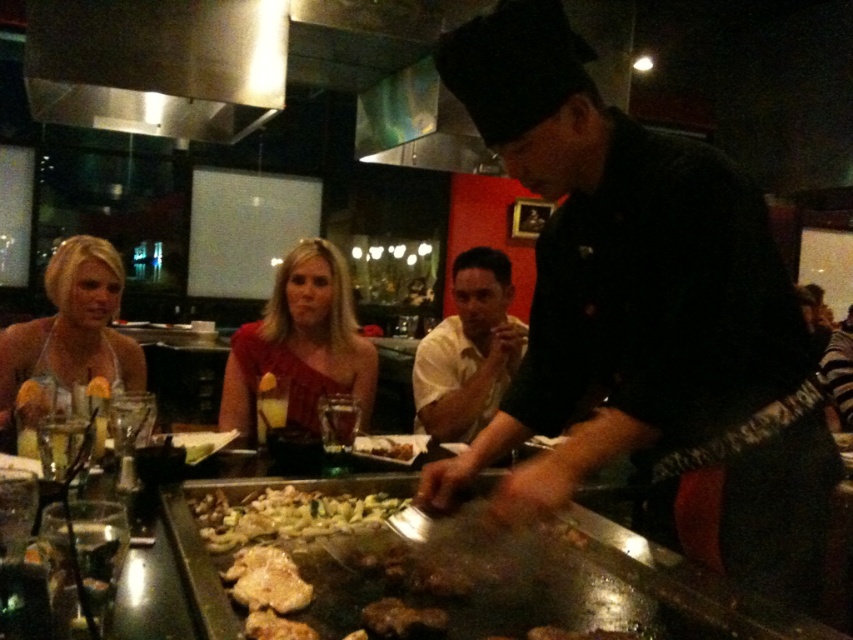
Which is more to the right, matte white dress at center or shiny silver pan at center?

Positioned to the right is shiny silver pan at center.

Which is behind, point (90, 240) or point (277, 516)?

The point (90, 240) is more distant.

The height and width of the screenshot is (640, 853). In order to click on matte white dress at center in this screenshot , I will do `click(73, 326)`.

Where is `stainless steel exhaust hood at upper center`? The width and height of the screenshot is (853, 640). stainless steel exhaust hood at upper center is located at coordinates (157, 65).

Does point (230, 93) come behind point (444, 436)?

Yes, it is.

Is point (222, 84) more distant than point (427, 397)?

Yes, point (222, 84) is farther from viewer.

Locate an element on the screen. The height and width of the screenshot is (640, 853). stainless steel exhaust hood at upper center is located at coordinates (157, 65).

Between metallic silver grill at center and stainless steel exhaust hood at upper center, which one appears on the left side from the viewer's perspective?

From the viewer's perspective, stainless steel exhaust hood at upper center appears more on the left side.

Which is in front, point (758, 611) or point (183, 40)?

Point (758, 611)

Which is in front, point (672, 625) or point (99, 1)?

Point (672, 625) is in front.

At what (x,y) coordinates should I click in order to perform the action: click on metallic silver grill at center. Please return your answer as a coordinate pair (x, y). This screenshot has height=640, width=853. Looking at the image, I should click on (554, 589).